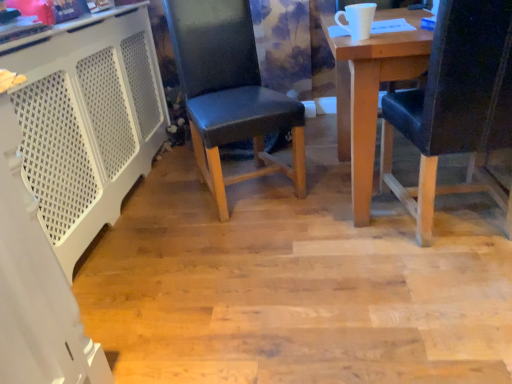
Image resolution: width=512 pixels, height=384 pixels. I want to click on free area below black leather chair at center, marked as the second chair in a right-to-left arrangement (from a real-world perspective), so click(252, 189).